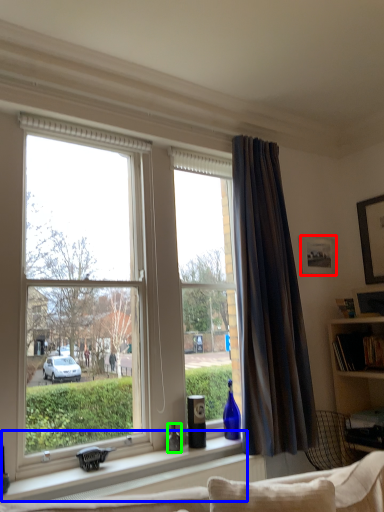
Question: Based on their relative distances, which object is nearer to picture frame (highlighted by a red box)? Choose from window sill (highlighted by a blue box) and bottle (highlighted by a green box).

Choices:
 (A) window sill
 (B) bottle

Answer: (B)